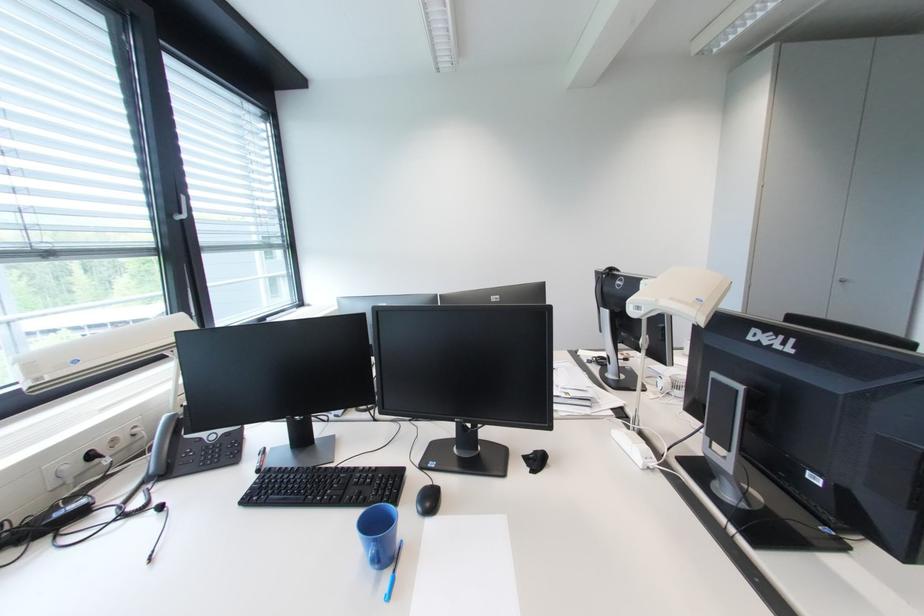
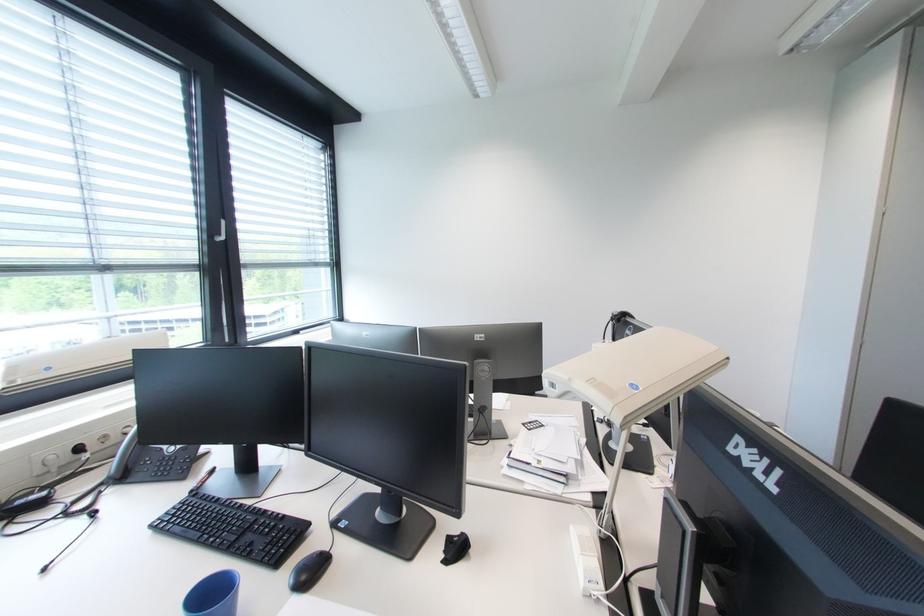
Question: The camera is either moving clockwise (left) or counter-clockwise (right) around the object. The first image is from the beginning of the video and the second image is from the end. Is the camera moving left or right when shooting the video?

Choices:
 (A) Left
 (B) Right

Answer: (B)